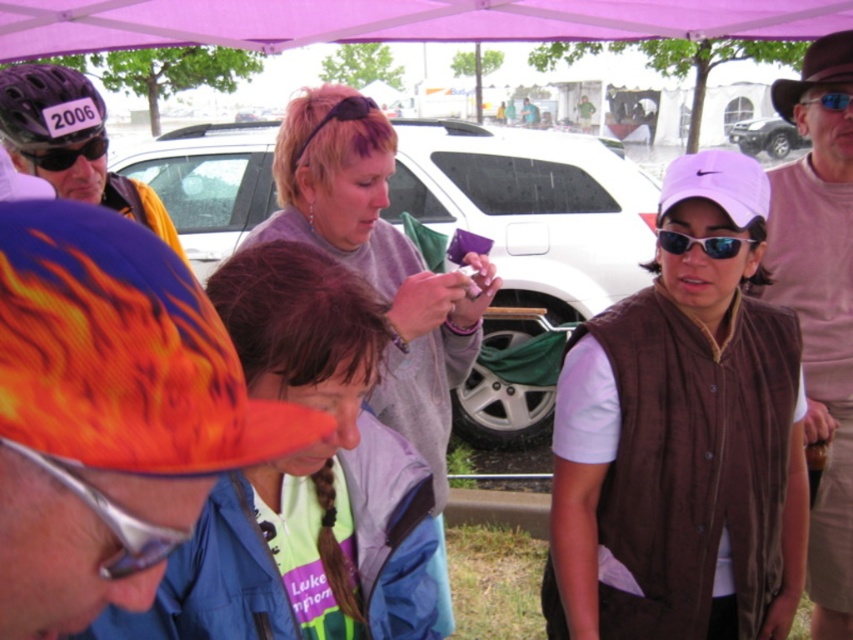
Question: Is white matte car at center closer to the viewer compared to matte purple phone at center?

Choices:
 (A) no
 (B) yes

Answer: (A)

Question: Is gray fleece sweatshirt at center thinner than blue reflective lens glasses at upper right?

Choices:
 (A) no
 (B) yes

Answer: (A)

Question: Which point is closer to the camera?

Choices:
 (A) pos(367,12)
 (B) pos(628,634)
 (C) pos(310,228)
 (D) pos(846,182)

Answer: (B)

Question: Among these points, which one is farthest from the camera?

Choices:
 (A) (809, 104)
 (B) (500, 368)

Answer: (B)

Question: Estimate the real-world distances between objects in this image. Which object is farther from the metallic silver suv at upper right?

Choices:
 (A) matte black helmet at left
 (B) purple matte helmet at upper left

Answer: (B)

Question: Does brown corduroy vest at center have a greater width compared to pink fabric hat at upper right?

Choices:
 (A) yes
 (B) no

Answer: (A)